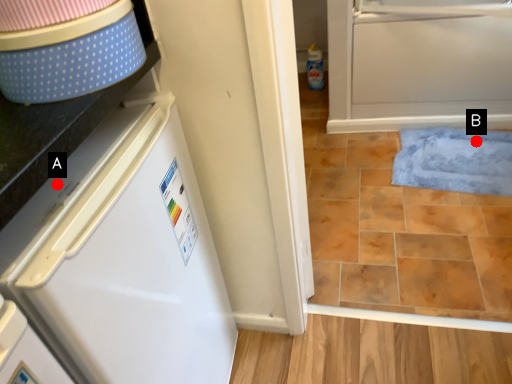
Question: Two points are circled on the image, labeled by A and B beside each circle. Which point appears farthest from the camera in this image?

Choices:
 (A) A is further
 (B) B is further

Answer: (B)